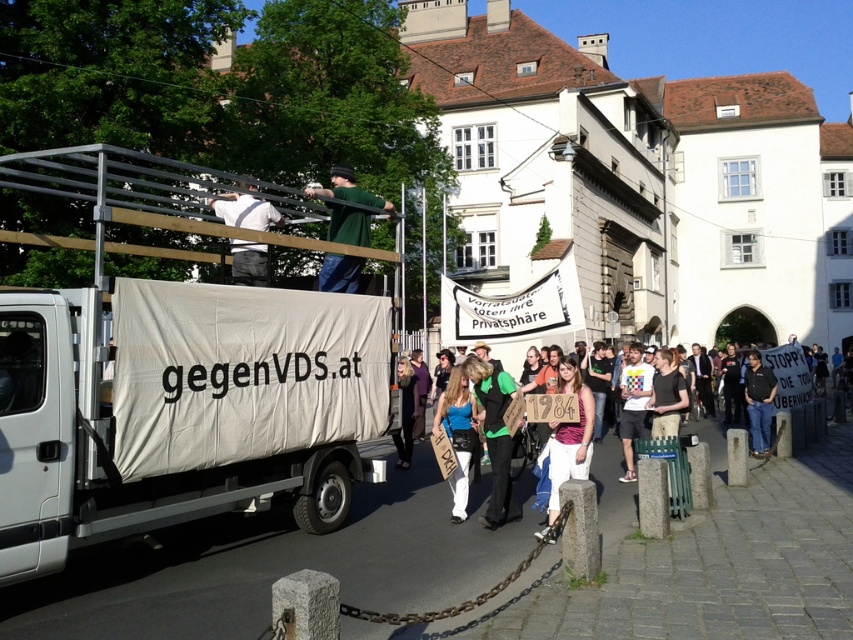
Question: Does cardboard signs at center have a lesser width compared to white fabric shirt at upper center?

Choices:
 (A) no
 (B) yes

Answer: (A)

Question: Which object is farther from the camera taking this photo?

Choices:
 (A) green matte shirt at upper center
 (B) dark blue shirt at center
 (C) cardboard signs at center

Answer: (B)

Question: Can you confirm if white fabric truck at upper left is positioned below green fabric vest at center?

Choices:
 (A) no
 (B) yes

Answer: (A)

Question: Is green fabric vest at center wider than white cotton shirt at center?

Choices:
 (A) no
 (B) yes

Answer: (B)

Question: Among these points, which one is farthest from the camera?

Choices:
 (A) (756, 445)
 (B) (337, 228)
 (C) (552, 502)
 (D) (477, 435)

Answer: (A)

Question: Estimate the real-world distances between objects in this image. Which object is farther from the cardboard signs at center?

Choices:
 (A) green fabric vest at center
 (B) white cotton shirt at center
 (C) white fabric truck at upper left
 (D) white fabric shirt at upper center

Answer: (C)